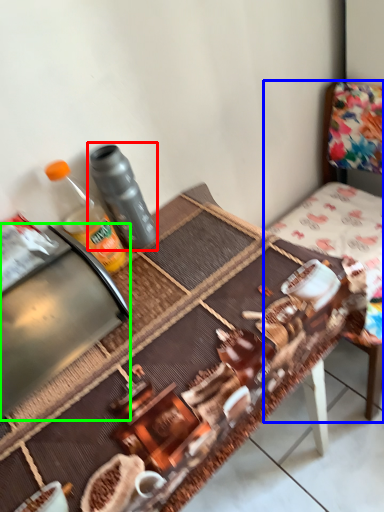
Question: Estimate the real-world distances between objects in this image. Which object is closer to bottle (highlighted by a red box), chair (highlighted by a blue box) or appliance (highlighted by a green box)?

Choices:
 (A) chair
 (B) appliance

Answer: (B)